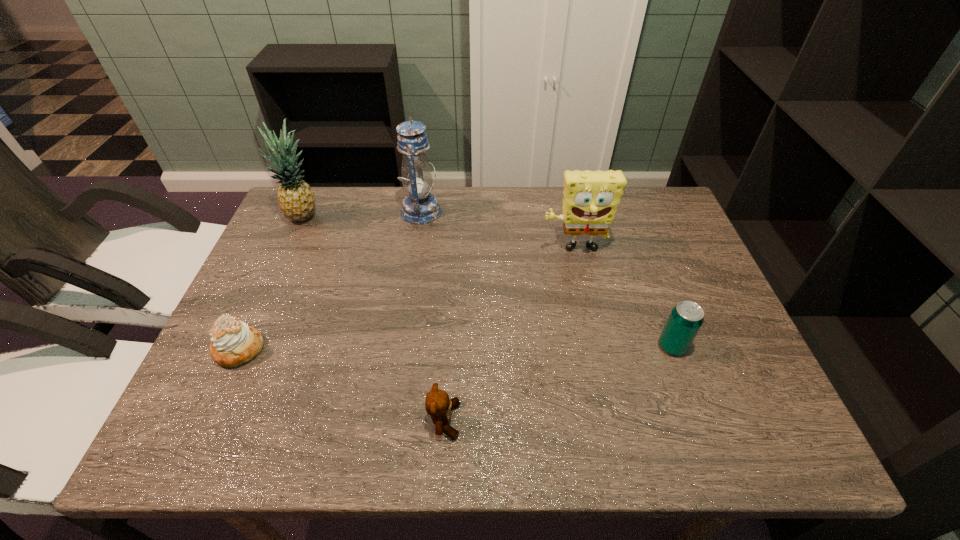
Where is `free location that satisfies the following two spatial constraints: 1. on the face of the third tallest object; 2. on the right side of the fourth tallest object`? free location that satisfies the following two spatial constraints: 1. on the face of the third tallest object; 2. on the right side of the fourth tallest object is located at coordinates (595, 346).

At what (x,y) coordinates should I click in order to perform the action: click on free space that satisfies the following two spatial constraints: 1. on the face of the fourth shortest object; 2. on the left side of the rightmost object. Please return your answer as a coordinate pair (x, y). This screenshot has height=540, width=960. Looking at the image, I should click on (595, 346).

Find the location of a particular element. This screenshot has height=540, width=960. vacant space that satisfies the following two spatial constraints: 1. on the back side of the pastry; 2. on the right side of the rightmost object is located at coordinates (241, 346).

You are a GUI agent. You are given a task and a screenshot of the screen. Output one action in this format:
    pyautogui.click(x=<x>, y=<y>)
    Task: Click on the free spot that satisfies the following two spatial constraints: 1. on the front-facing side of the fourth object from right to left; 2. on the front side of the pineapple
    Image resolution: width=960 pixels, height=540 pixels.
    Given the screenshot: What is the action you would take?
    pyautogui.click(x=420, y=217)

Locate an element on the screen. The image size is (960, 540). free space that satisfies the following two spatial constraints: 1. on the face of the sponge; 2. on the left side of the rightmost object is located at coordinates (595, 346).